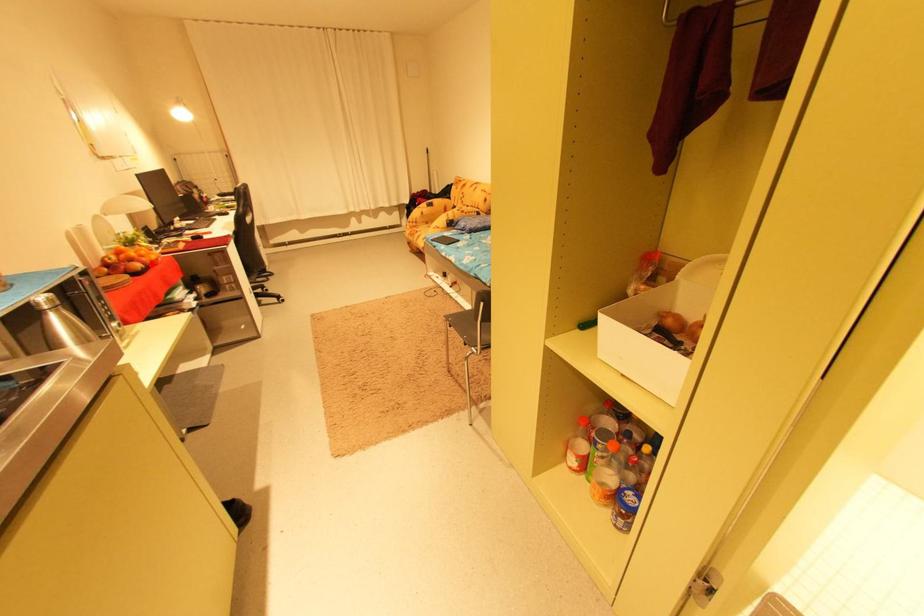
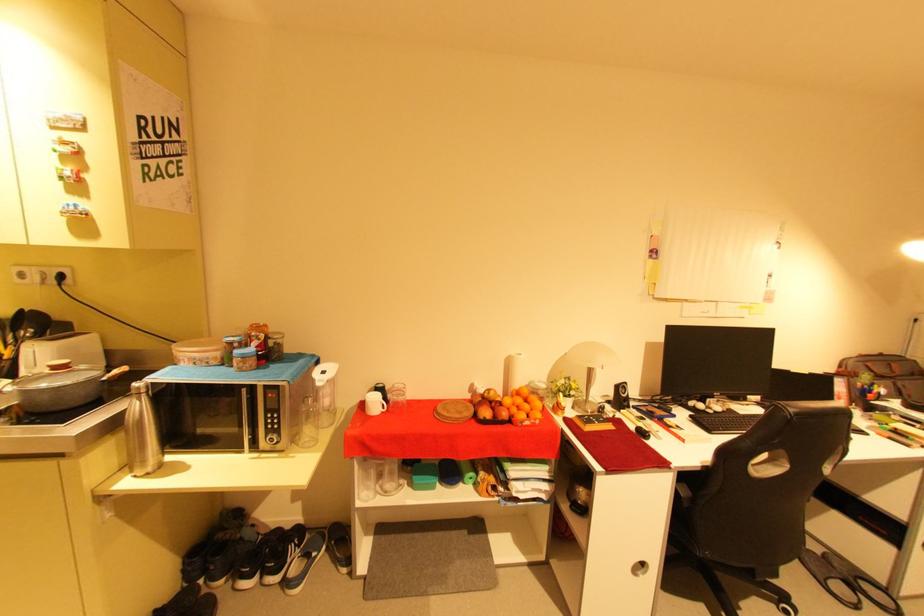
In the second image, find the point that corresponds to the highlighted location in the first image.

(503, 416)